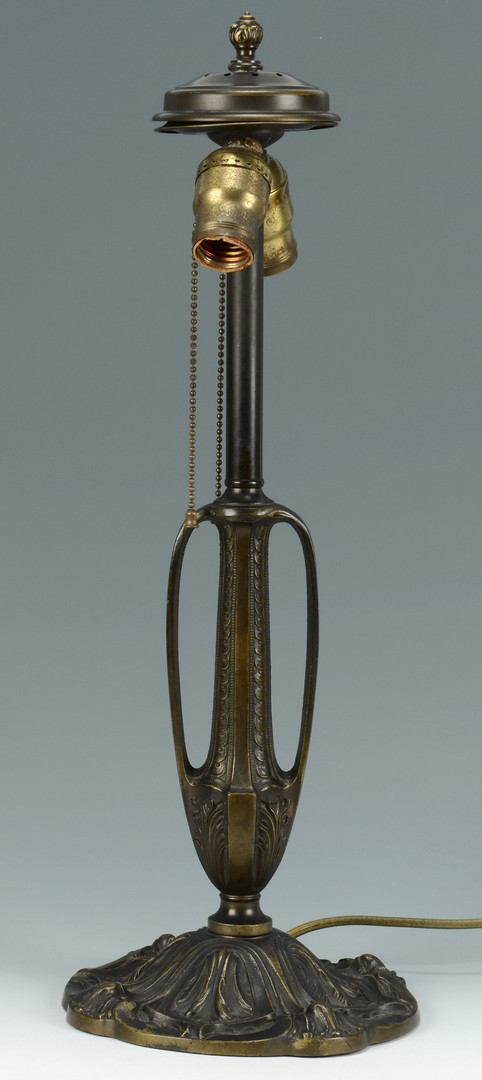
Find the location of `cord`. cord is located at coordinates (357, 917).